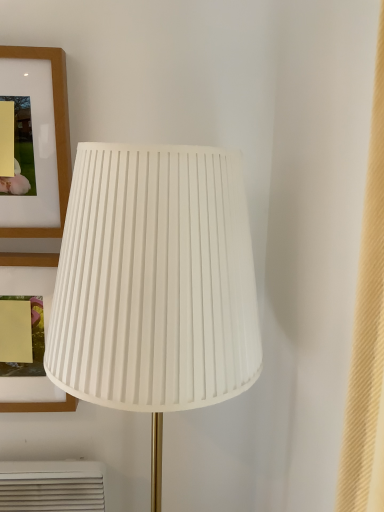
Question: From a real-world perspective, is matte wood picture frame at upper left, positioned as the 1th picture frame in bottom-to-top order, beneath matte wood picture frame at upper left, placed as the second picture frame when sorted from bottom to top?

Choices:
 (A) yes
 (B) no

Answer: (A)

Question: Considering the relative sizes of matte wood picture frame at upper left, arranged as the 2th picture frame when viewed from the top, and matte wood picture frame at upper left, which is the first picture frame from top to bottom, in the image provided, is matte wood picture frame at upper left, arranged as the 2th picture frame when viewed from the top, shorter than matte wood picture frame at upper left, which is the first picture frame from top to bottom,?

Choices:
 (A) no
 (B) yes

Answer: (A)

Question: Is matte wood picture frame at upper left, arranged as the 2th picture frame when viewed from the top, behind matte wood picture frame at upper left, which is the first picture frame from top to bottom?

Choices:
 (A) yes
 (B) no

Answer: (A)

Question: Considering the relative positions of matte wood picture frame at upper left, positioned as the 1th picture frame in bottom-to-top order, and matte wood picture frame at upper left, placed as the second picture frame when sorted from bottom to top, in the image provided, is matte wood picture frame at upper left, positioned as the 1th picture frame in bottom-to-top order, to the right of matte wood picture frame at upper left, placed as the second picture frame when sorted from bottom to top, from the viewer's perspective?

Choices:
 (A) yes
 (B) no

Answer: (B)

Question: Is matte wood picture frame at upper left, arranged as the 2th picture frame when viewed from the top, next to matte wood picture frame at upper left, which is the first picture frame from top to bottom, and touching it?

Choices:
 (A) yes
 (B) no

Answer: (B)

Question: Is matte wood picture frame at upper left, placed as the second picture frame when sorted from bottom to top, bigger or smaller than matte wood picture frame at upper left, arranged as the 2th picture frame when viewed from the top?

Choices:
 (A) big
 (B) small

Answer: (B)

Question: From the image's perspective, is matte wood picture frame at upper left, which is the first picture frame from top to bottom, located above or below matte wood picture frame at upper left, positioned as the 1th picture frame in bottom-to-top order?

Choices:
 (A) above
 (B) below

Answer: (A)

Question: Based on their positions, is matte wood picture frame at upper left, placed as the second picture frame when sorted from bottom to top, located to the left or right of matte wood picture frame at upper left, positioned as the 1th picture frame in bottom-to-top order?

Choices:
 (A) right
 (B) left

Answer: (A)

Question: Does point click(71, 164) appear closer or farther from the camera than point click(36, 411)?

Choices:
 (A) farther
 (B) closer

Answer: (B)

Question: Considering the positions of point (165, 352) and point (64, 151), is point (165, 352) closer or farther from the camera than point (64, 151)?

Choices:
 (A) farther
 (B) closer

Answer: (B)

Question: From the image's perspective, is white pleated fabric lampshade at center above or below matte wood picture frame at upper left, placed as the second picture frame when sorted from bottom to top?

Choices:
 (A) below
 (B) above

Answer: (A)

Question: In the image, is white pleated fabric lampshade at center positioned in front of or behind matte wood picture frame at upper left, which is the first picture frame from top to bottom?

Choices:
 (A) front
 (B) behind

Answer: (A)

Question: Is white pleated fabric lampshade at center taller or shorter than matte wood picture frame at upper left, which is the first picture frame from top to bottom?

Choices:
 (A) tall
 (B) short

Answer: (A)

Question: From the image's perspective, is matte wood picture frame at upper left, arranged as the 2th picture frame when viewed from the top, located above or below matte wood picture frame at upper left, placed as the second picture frame when sorted from bottom to top?

Choices:
 (A) below
 (B) above

Answer: (A)

Question: Is matte wood picture frame at upper left, positioned as the 1th picture frame in bottom-to-top order, to the left or to the right of matte wood picture frame at upper left, which is the first picture frame from top to bottom, in the image?

Choices:
 (A) left
 (B) right

Answer: (A)